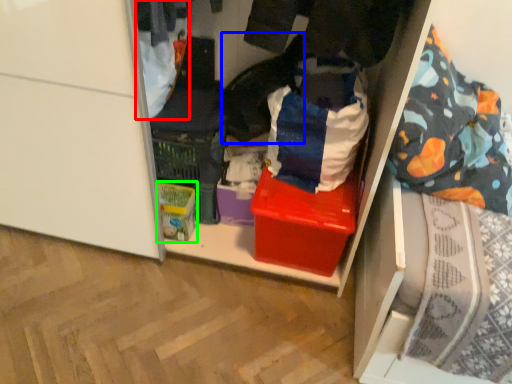
Question: Estimate the real-world distances between objects in this image. Which object is closer to clothing (highlighted by a red box), clothing (highlighted by a blue box) or storage box (highlighted by a green box)?

Choices:
 (A) clothing
 (B) storage box

Answer: (A)